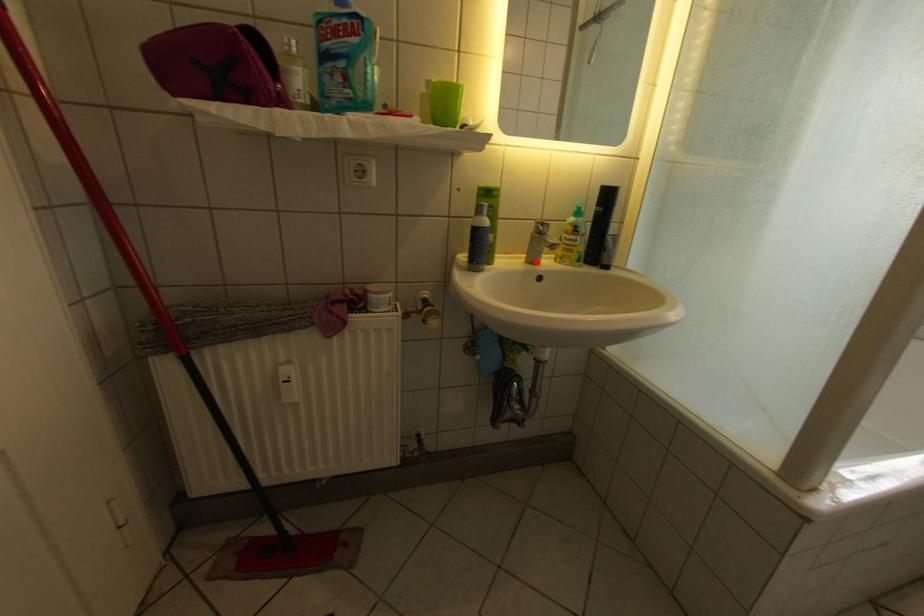
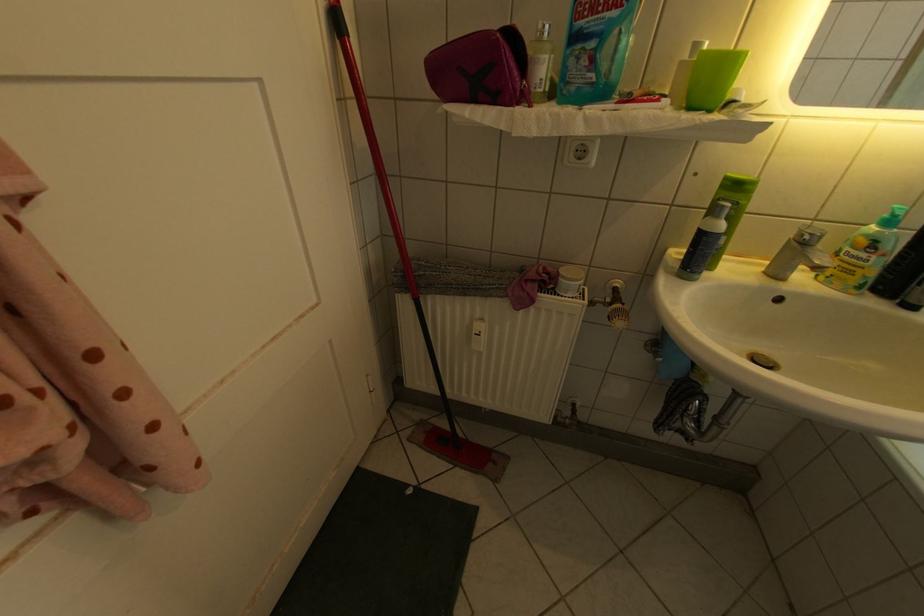
Find the pixel in the second image that matches the highlighted location in the first image.

(774, 270)